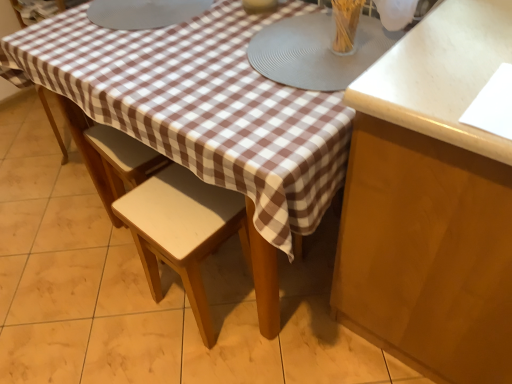
Where is `free space in front of clear glass vase at upper center`? The width and height of the screenshot is (512, 384). free space in front of clear glass vase at upper center is located at coordinates (337, 74).